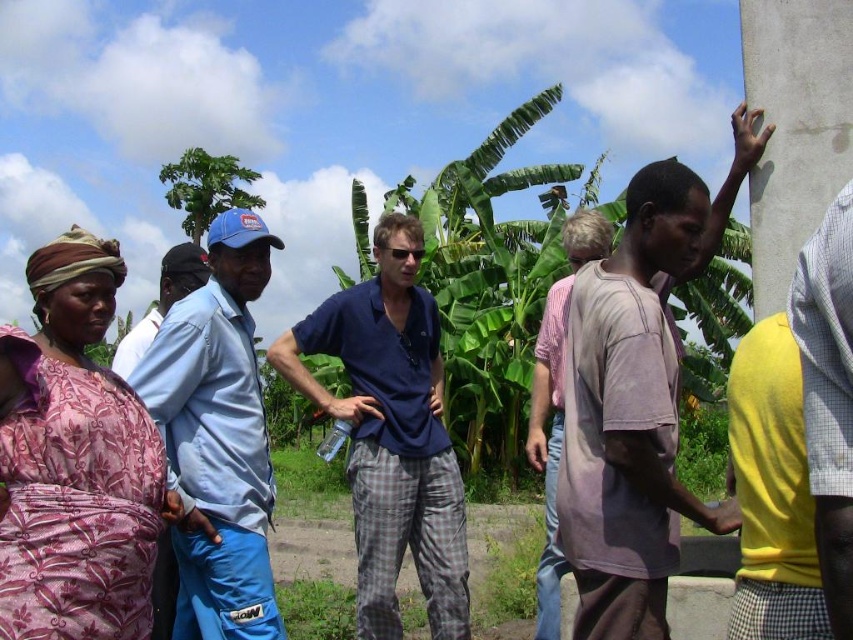
You are organizing a clothing donation drive and need to categorize shirts by size. You have two shirts to sort out. The light brown cotton shirt at right and the blue cotton shirt at center. Which shirt should you place in the small size bin?

The light brown cotton shirt at right should be placed in the small size bin because it has a smaller size compared to the blue cotton shirt at center.

You are standing at the origin point of the image. You want to walk towards the point labeled as point (680, 298). However, there is an obstacle at point (154, 326). Will you encounter the obstacle before reaching your destination?

Yes, you will encounter the obstacle at point (154, 326) before reaching point (680, 298) because point (680, 298) is behind point (154, 326).